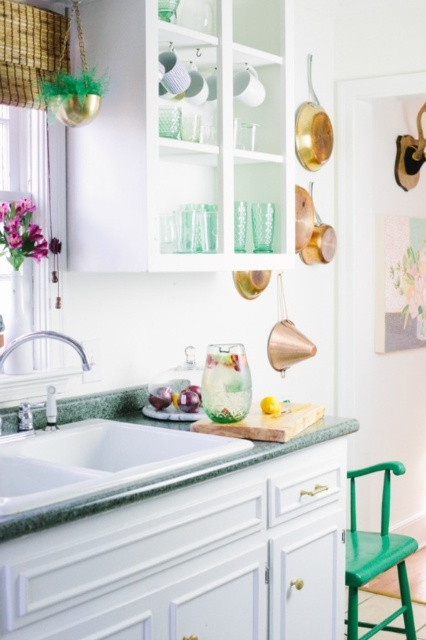
Between green marble countertop at center and brushed metal faucet at lower left, which one has more height?

Standing taller between the two is green marble countertop at center.

Is green marble countertop at center further to camera compared to brushed metal faucet at lower left?

No, green marble countertop at center is in front of brushed metal faucet at lower left.

Measure the distance between green marble countertop at center and camera.

green marble countertop at center is 4.29 feet away from camera.

Image resolution: width=426 pixels, height=640 pixels. I want to click on green marble countertop at center, so click(192, 556).

Between point (198, 448) and point (85, 353), which one is positioned in front?

Point (198, 448) is in front.

Is white ceramic sink at center closer to the viewer compared to satin nickel faucet at sink left?

Yes.

Image resolution: width=426 pixels, height=640 pixels. Find the location of `white ceramic sink at center`. white ceramic sink at center is located at coordinates [94, 460].

In the scene shown: Who is positioned more to the right, green matte stool at lower right or brushed metal faucet at lower left?

From the viewer's perspective, green matte stool at lower right appears more on the right side.

Who is more forward, (371, 566) or (60, 339)?

Point (60, 339) is in front.

Identify the location of green matte stool at lower right. (377, 557).